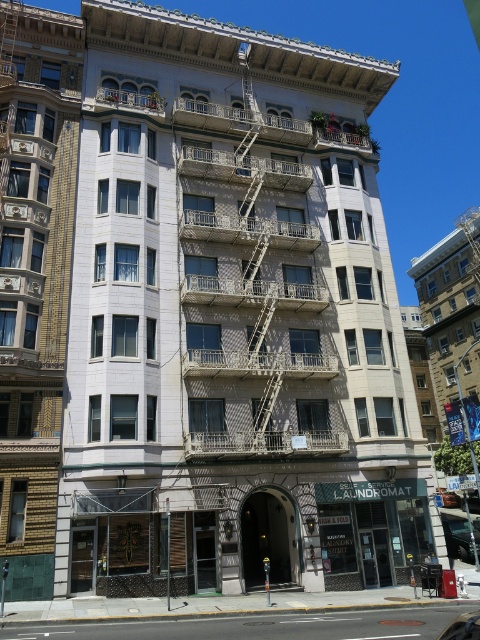
Question: Which of the following is the closest to the observer?

Choices:
 (A) (236, 244)
 (B) (446, 632)
 (C) (452, 493)

Answer: (B)

Question: Can you confirm if metallic silver fire escape at center is wider than metallic silver car at lower right?

Choices:
 (A) yes
 (B) no

Answer: (A)

Question: In this image, where is metallic silver fire escape at center located relative to metallic silver car at center?

Choices:
 (A) below
 (B) above

Answer: (B)

Question: Does metallic silver car at lower right have a lesser width compared to metallic silver car at center?

Choices:
 (A) no
 (B) yes

Answer: (A)

Question: Which point is closer to the camera?

Choices:
 (A) (456, 502)
 (B) (472, 632)

Answer: (B)

Question: Estimate the real-world distances between objects in this image. Which object is farther from the metallic silver car at center?

Choices:
 (A) metallic silver fire escape at center
 (B) metallic silver car at lower right

Answer: (A)